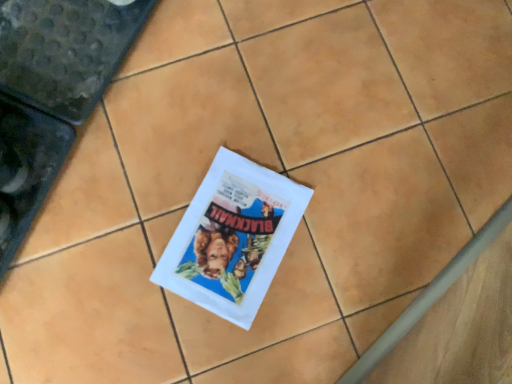
Locate an element on the screen. Image resolution: width=512 pixels, height=384 pixels. free space above white paper flyer at center (from a real-world perspective) is located at coordinates (237, 233).